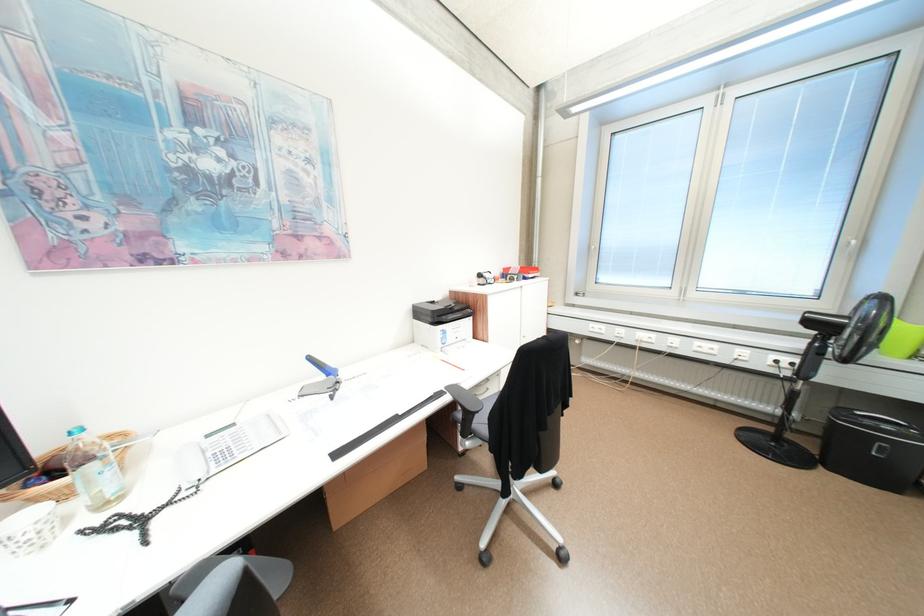
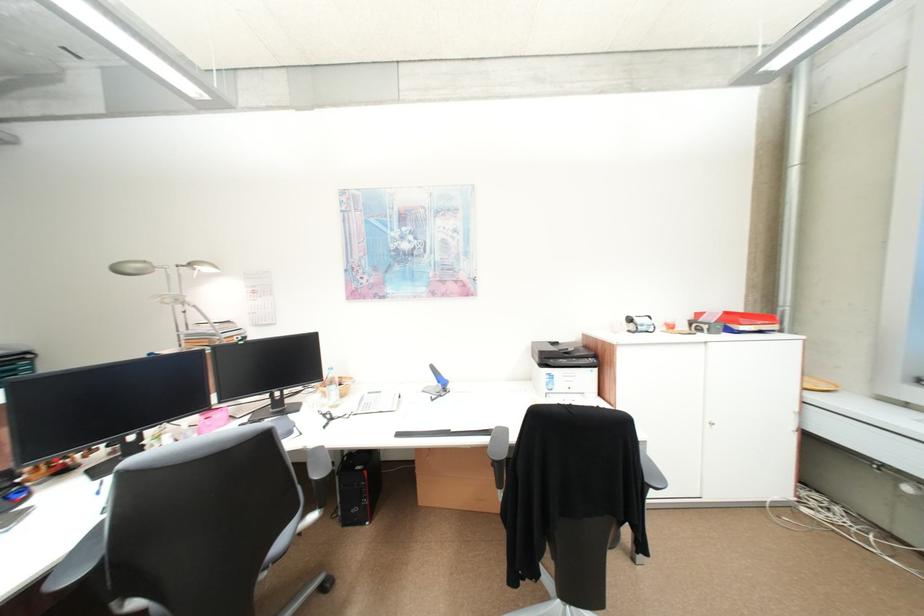
Question: The camera is either moving clockwise (left) or counter-clockwise (right) around the object. The first image is from the beginning of the video and the second image is from the end. Is the camera moving left or right when shooting the video?

Choices:
 (A) Left
 (B) Right

Answer: (B)